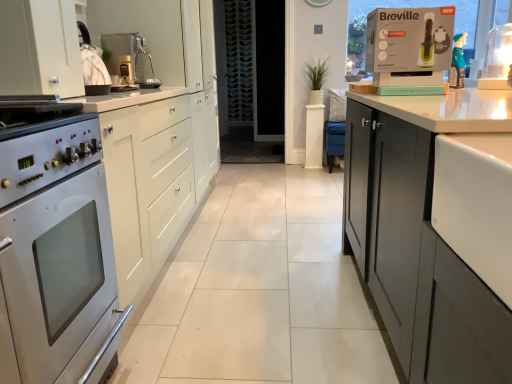
Question: Is metallic silver coffee machine at upper center touching matte white box at upper right?

Choices:
 (A) yes
 (B) no

Answer: (B)

Question: Is metallic silver coffee machine at upper center to the right of matte white box at upper right from the viewer's perspective?

Choices:
 (A) yes
 (B) no

Answer: (B)

Question: From the image's perspective, is metallic silver coffee machine at upper center on matte white box at upper right?

Choices:
 (A) no
 (B) yes

Answer: (B)

Question: Is metallic silver coffee machine at upper center bigger than matte white box at upper right?

Choices:
 (A) no
 (B) yes

Answer: (B)

Question: Is metallic silver coffee machine at upper center outside of matte white box at upper right?

Choices:
 (A) no
 (B) yes

Answer: (B)

Question: From the image's perspective, is white glossy countertop at right above or below white matte cabinet at left?

Choices:
 (A) above
 (B) below

Answer: (B)

Question: In the image, is white glossy countertop at right on the left side or the right side of white matte cabinet at left?

Choices:
 (A) right
 (B) left

Answer: (A)

Question: Looking at the image, does white glossy countertop at right seem bigger or smaller compared to white matte cabinet at left?

Choices:
 (A) small
 (B) big

Answer: (A)

Question: In terms of height, does white glossy countertop at right look taller or shorter compared to white matte cabinet at left?

Choices:
 (A) tall
 (B) short

Answer: (B)

Question: Would you say white glossy lamp at upper right is inside or outside satin silver oven at left?

Choices:
 (A) inside
 (B) outside

Answer: (B)

Question: Considering the relative positions of white glossy lamp at upper right and satin silver oven at left in the image provided, is white glossy lamp at upper right to the left or to the right of satin silver oven at left?

Choices:
 (A) right
 (B) left

Answer: (A)

Question: From a real-world perspective, is white glossy lamp at upper right above or below satin silver oven at left?

Choices:
 (A) below
 (B) above

Answer: (B)

Question: From their relative heights in the image, would you say white glossy lamp at upper right is taller or shorter than satin silver oven at left?

Choices:
 (A) short
 (B) tall

Answer: (A)

Question: From the image's perspective, is white glossy countertop at right located above or below matte white box at upper right?

Choices:
 (A) below
 (B) above

Answer: (A)

Question: Would you say white glossy countertop at right is to the left or to the right of matte white box at upper right in the picture?

Choices:
 (A) right
 (B) left

Answer: (B)